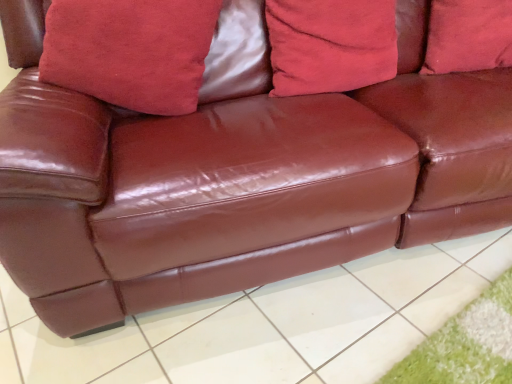
Question: Is there a large distance between suede-like red pillow at upper center, arranged as the third pillow when viewed from the right, and suede-like red pillow at upper center, which ranks as the third pillow in left-to-right order?

Choices:
 (A) no
 (B) yes

Answer: (A)

Question: Can you see suede-like red pillow at upper center, arranged as the third pillow when viewed from the right, touching suede-like red pillow at upper center, which appears as the 1th pillow when viewed from the right?

Choices:
 (A) no
 (B) yes

Answer: (A)

Question: Can you confirm if suede-like red pillow at upper center, arranged as the third pillow when viewed from the right, is wider than suede-like red pillow at upper center, which appears as the 1th pillow when viewed from the right?

Choices:
 (A) no
 (B) yes

Answer: (B)

Question: Can you confirm if suede-like red pillow at upper center, the 1th pillow from the left, is shorter than suede-like red pillow at upper center, which appears as the 1th pillow when viewed from the right?

Choices:
 (A) no
 (B) yes

Answer: (A)

Question: Is suede-like red pillow at upper center, arranged as the third pillow when viewed from the right, bigger than suede-like red pillow at upper center, which ranks as the third pillow in left-to-right order?

Choices:
 (A) no
 (B) yes

Answer: (B)

Question: From the image's perspective, is velvet red pillow at center, acting as the second pillow starting from the left, above or below shiny brown leather couch at center?

Choices:
 (A) above
 (B) below

Answer: (A)

Question: Is velvet red pillow at center, which ranks as the second pillow in right-to-left order, taller or shorter than shiny brown leather couch at center?

Choices:
 (A) short
 (B) tall

Answer: (B)

Question: Considering the positions of velvet red pillow at center, acting as the second pillow starting from the left, and shiny brown leather couch at center in the image, is velvet red pillow at center, acting as the second pillow starting from the left, bigger or smaller than shiny brown leather couch at center?

Choices:
 (A) small
 (B) big

Answer: (A)

Question: Is velvet red pillow at center, which ranks as the second pillow in right-to-left order, situated inside shiny brown leather couch at center or outside?

Choices:
 (A) inside
 (B) outside

Answer: (B)

Question: Looking at their shapes, would you say suede-like red pillow at upper center, which appears as the 1th pillow when viewed from the right, is wider or thinner than suede-like red pillow at upper center, arranged as the third pillow when viewed from the right?

Choices:
 (A) thin
 (B) wide

Answer: (A)

Question: Choose the correct answer: Is suede-like red pillow at upper center, which appears as the 1th pillow when viewed from the right, inside suede-like red pillow at upper center, the 1th pillow from the left, or outside it?

Choices:
 (A) inside
 (B) outside

Answer: (B)

Question: From the image's perspective, is suede-like red pillow at upper center, which ranks as the third pillow in left-to-right order, positioned above or below suede-like red pillow at upper center, arranged as the third pillow when viewed from the right?

Choices:
 (A) below
 (B) above

Answer: (B)

Question: From their relative heights in the image, would you say suede-like red pillow at upper center, which ranks as the third pillow in left-to-right order, is taller or shorter than suede-like red pillow at upper center, arranged as the third pillow when viewed from the right?

Choices:
 (A) short
 (B) tall

Answer: (A)

Question: Is point (418, 340) positioned closer to the camera than point (314, 44)?

Choices:
 (A) farther
 (B) closer

Answer: (B)

Question: Do you think shiny brown leather couch at center is within velvet red pillow at center, acting as the second pillow starting from the left, or outside of it?

Choices:
 (A) inside
 (B) outside

Answer: (B)